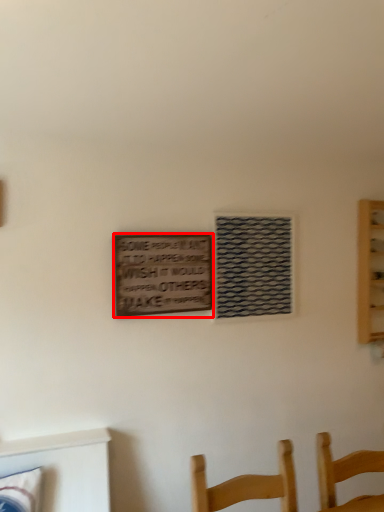
Question: Observing the image, what is the correct spatial positioning of plaque (annotated by the red box) in reference to window?

Choices:
 (A) right
 (B) left

Answer: (B)